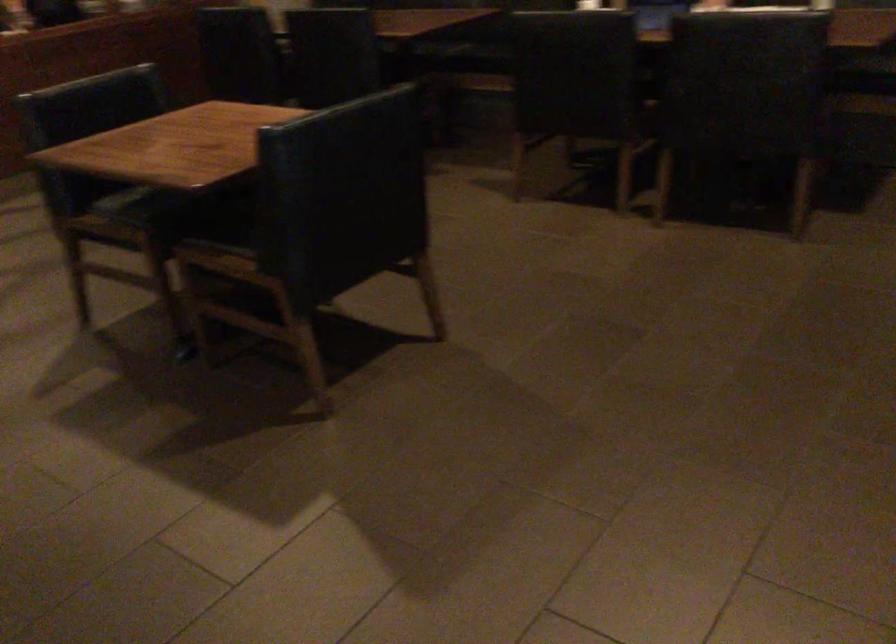
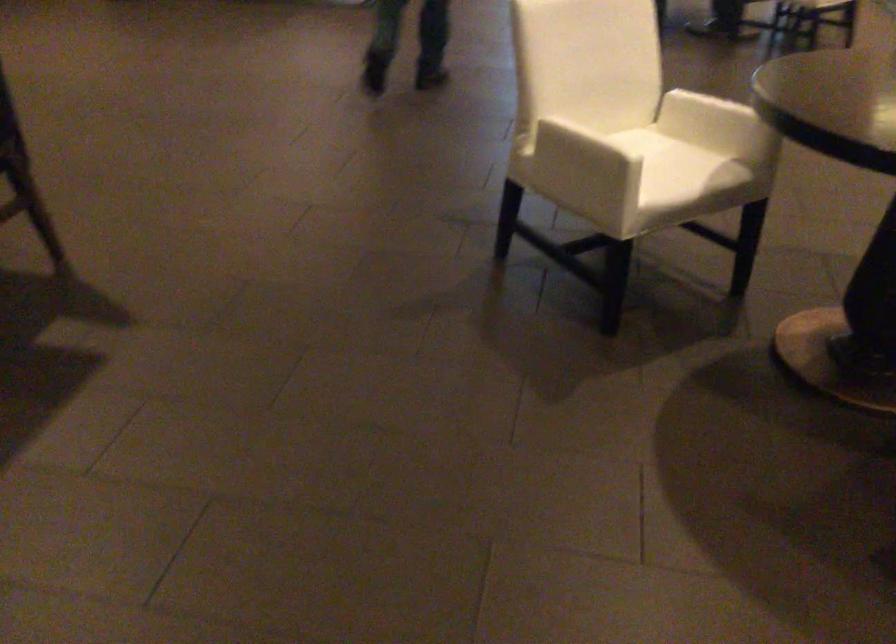
The first image is from the beginning of the video and the second image is from the end. How did the camera likely rotate when shooting the video?

The camera rotated toward right-down.